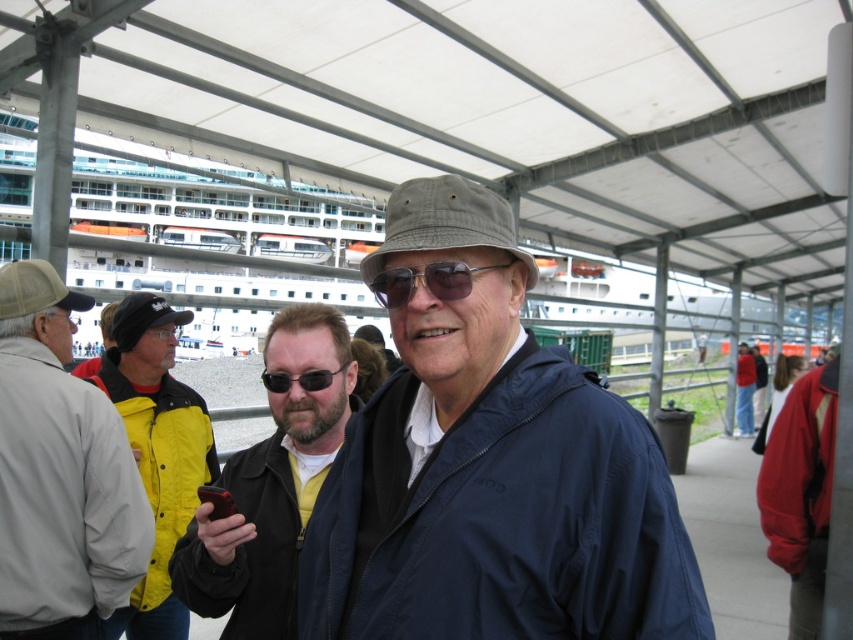
You are taking a photo of the scene and want to include both the red fleece jacket at lower right and the rubberized black phone at center. Which object should you adjust your camera angle to focus on first to ensure both are in frame?

You should focus on the red fleece jacket at lower right first because it is positioned to the right of the rubberized black phone at center, so adjusting the angle to include the rightmost object ensures the left one is already in frame.